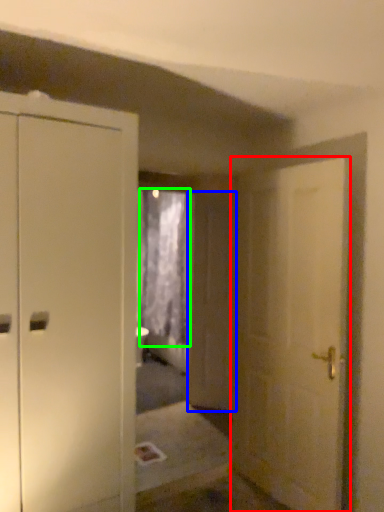
Question: Which object is positioned farthest from door (highlighted by a red box)? Select from screen door (highlighted by a blue box) and curtain (highlighted by a green box).

Choices:
 (A) screen door
 (B) curtain

Answer: (B)